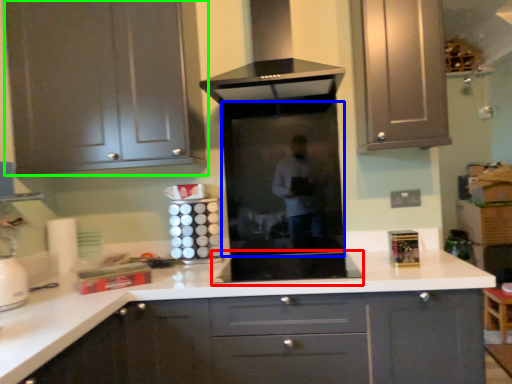
Question: Based on their relative distances, which object is nearer to appliance (highlighted by a red box)? Choose from glass door (highlighted by a blue box) and cabinetry (highlighted by a green box).

Choices:
 (A) glass door
 (B) cabinetry

Answer: (A)